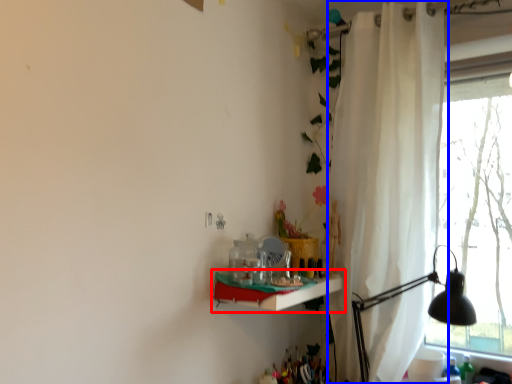
Question: Which of the following is the closest to the observer, shelf (highlighted by a red box) or curtain (highlighted by a blue box)?

Choices:
 (A) shelf
 (B) curtain

Answer: (A)